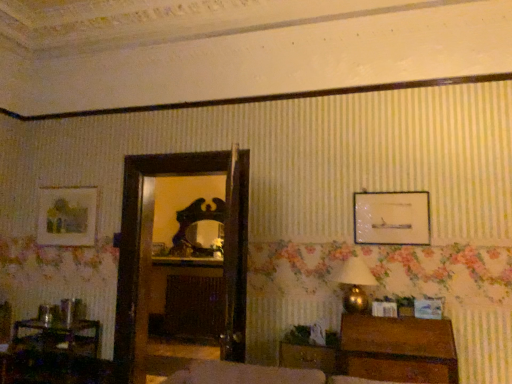
Question: Does matte wooden picture frame at upper left, which is counted as the first picture frame, starting from the left, come in front of wooden chest at lower right?

Choices:
 (A) yes
 (B) no

Answer: (B)

Question: From a real-world perspective, is matte wooden picture frame at upper left, which is counted as the second picture frame, starting from the bottom, located higher than wooden chest at lower right?

Choices:
 (A) yes
 (B) no

Answer: (A)

Question: From a real-world perspective, is matte wooden picture frame at upper left, which is counted as the first picture frame, starting from the left, positioned under wooden chest at lower right based on gravity?

Choices:
 (A) yes
 (B) no

Answer: (B)

Question: Can you confirm if matte wooden picture frame at upper left, which is the 3th picture frame from right to left, is thinner than wooden chest at lower right?

Choices:
 (A) yes
 (B) no

Answer: (A)

Question: Would you say matte wooden picture frame at upper left, which is counted as the second picture frame, starting from the bottom, is outside wooden chest at lower right?

Choices:
 (A) yes
 (B) no

Answer: (A)

Question: Is wooden picture frame at center, the 2th picture frame in the right-to-left sequence, bigger or smaller than wooden table at lower left?

Choices:
 (A) small
 (B) big

Answer: (A)

Question: Considering the positions of wooden picture frame at center, the 3th picture frame positioned from the top, and wooden table at lower left in the image, is wooden picture frame at center, the 3th picture frame positioned from the top, taller or shorter than wooden table at lower left?

Choices:
 (A) tall
 (B) short

Answer: (B)

Question: From the image's perspective, relative to wooden table at lower left, is wooden picture frame at center, which is the 2th picture frame in left-to-right order, above or below?

Choices:
 (A) above
 (B) below

Answer: (A)

Question: From a real-world perspective, relative to wooden table at lower left, is wooden picture frame at center, positioned as the third picture frame in front-to-back order, vertically above or below?

Choices:
 (A) above
 (B) below

Answer: (A)

Question: From the image's perspective, is matte glass picture frame at upper right, the 3th picture frame in the left-to-right sequence, positioned above or below wooden picture frame at center, positioned as the third picture frame in front-to-back order?

Choices:
 (A) below
 (B) above

Answer: (B)

Question: From their relative heights in the image, would you say matte glass picture frame at upper right, acting as the 3th picture frame starting from the back, is taller or shorter than wooden picture frame at center, which is the 2th picture frame in left-to-right order?

Choices:
 (A) short
 (B) tall

Answer: (B)

Question: In terms of size, does matte glass picture frame at upper right, which is the 1th picture frame from top to bottom, appear bigger or smaller than wooden picture frame at center, the 2th picture frame in the right-to-left sequence?

Choices:
 (A) small
 (B) big

Answer: (B)

Question: From a real-world perspective, relative to wooden picture frame at center, the 2th picture frame in the right-to-left sequence, is matte glass picture frame at upper right, placed as the third picture frame when sorted from bottom to top, vertically above or below?

Choices:
 (A) above
 (B) below

Answer: (A)

Question: Considering the positions of wooden drawer at lower right and gold metallic table lamp at right in the image, is wooden drawer at lower right wider or thinner than gold metallic table lamp at right?

Choices:
 (A) thin
 (B) wide

Answer: (B)

Question: In terms of height, does wooden drawer at lower right look taller or shorter compared to gold metallic table lamp at right?

Choices:
 (A) short
 (B) tall

Answer: (A)